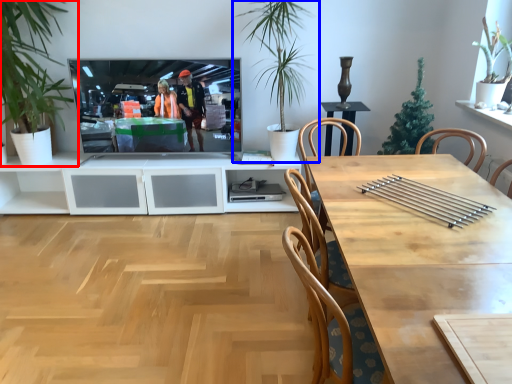
Question: Which point is further to the camera, houseplant (highlighted by a red box) or houseplant (highlighted by a blue box)?

Choices:
 (A) houseplant
 (B) houseplant

Answer: (B)